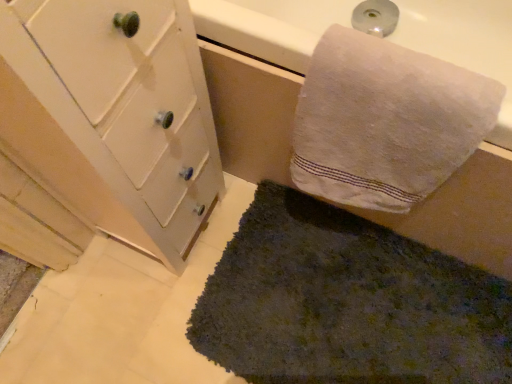
This screenshot has width=512, height=384. What do you see at coordinates (113, 115) in the screenshot?
I see `white painted wood cabinet at left` at bounding box center [113, 115].

The height and width of the screenshot is (384, 512). I want to click on dark green shaggy rug at lower center, so click(x=347, y=303).

Find the location of `white painted wood cabinet at left`. white painted wood cabinet at left is located at coordinates (113, 115).

In the image, there is a dark green shaggy rug at lower center. At what (x,y) coordinates should I click in order to perform the action: click on bathroom cabinet above it (from the image's perspective). Please return your answer as a coordinate pair (x, y). Looking at the image, I should click on click(x=113, y=115).

Is point (179, 58) more distant than point (343, 215)?

No, it is in front of (343, 215).

From the picture: Does white painted wood cabinet at left appear on the right side of dark green shaggy rug at lower center?

No.

Can you confirm if white painted wood cabinet at left is wider than dark green shaggy rug at lower center?

Incorrect, the width of white painted wood cabinet at left does not surpass that of dark green shaggy rug at lower center.

Does dark green shaggy rug at lower center appear on the right side of white cotton towel at upper right?

Yes, dark green shaggy rug at lower center is to the right of white cotton towel at upper right.

From a real-world perspective, is dark green shaggy rug at lower center positioned under white cotton towel at upper right based on gravity?

Yes, from a real-world perspective, dark green shaggy rug at lower center is beneath white cotton towel at upper right.

Is dark green shaggy rug at lower center turned away from white cotton towel at upper right?

No, white cotton towel at upper right is not at the back of dark green shaggy rug at lower center.

Can you confirm if white painted wood cabinet at left is positioned to the left of white cotton towel at upper right?

Yes, white painted wood cabinet at left is to the left of white cotton towel at upper right.

Choose the correct answer: Is white painted wood cabinet at left inside white cotton towel at upper right or outside it?

white painted wood cabinet at left cannot be found inside white cotton towel at upper right.

Is white painted wood cabinet at left facing away from white cotton towel at upper right?

No, white painted wood cabinet at left's orientation is not away from white cotton towel at upper right.

Image resolution: width=512 pixels, height=384 pixels. Identify the location of towel below the white painted wood cabinet at left (from the image's perspective). point(385,122).

Considering the sizes of objects white cotton towel at upper right and dark green shaggy rug at lower center in the image provided, who is thinner, white cotton towel at upper right or dark green shaggy rug at lower center?

Thinner between the two is white cotton towel at upper right.

Looking at this image, is white cotton towel at upper right looking in the opposite direction of dark green shaggy rug at lower center?

white cotton towel at upper right is not turned away from dark green shaggy rug at lower center.

Do you think white cotton towel at upper right is within dark green shaggy rug at lower center, or outside of it?

white cotton towel at upper right is spatially situated outside dark green shaggy rug at lower center.

Visually, is white cotton towel at upper right positioned to the left or to the right of dark green shaggy rug at lower center?

white cotton towel at upper right is to the left of dark green shaggy rug at lower center.

Between white cotton towel at upper right and white painted wood cabinet at left, which one appears on the right side from the viewer's perspective?

Positioned to the right is white cotton towel at upper right.

From a real-world perspective, is white cotton towel at upper right on top of white painted wood cabinet at left?

Indeed, from a real-world perspective, white cotton towel at upper right stands above white painted wood cabinet at left.

This screenshot has width=512, height=384. Find the location of `towel lying behind the white painted wood cabinet at left`. towel lying behind the white painted wood cabinet at left is located at coordinates (385, 122).

Is white cotton towel at upper right not close to white painted wood cabinet at left?

No, there isn't a large distance between white cotton towel at upper right and white painted wood cabinet at left.

Considering the positions of objects dark green shaggy rug at lower center and white painted wood cabinet at left in the image provided, who is in front, dark green shaggy rug at lower center or white painted wood cabinet at left?

white painted wood cabinet at left is in front.

In the image, is dark green shaggy rug at lower center on the left side or the right side of white painted wood cabinet at left?

Based on their positions, dark green shaggy rug at lower center is located to the right of white painted wood cabinet at left.

Is dark green shaggy rug at lower center facing towards white painted wood cabinet at left?

No, dark green shaggy rug at lower center does not turn towards white painted wood cabinet at left.

What's the angular difference between dark green shaggy rug at lower center and white painted wood cabinet at left's facing directions?

88.9 degrees.

Find the location of a particular element. The width and height of the screenshot is (512, 384). bathroom cabinet on the left of dark green shaggy rug at lower center is located at coordinates (113, 115).

Identify the location of bath mat lying behind the white cotton towel at upper right. (347, 303).

From the image, which object appears to be farther from white painted wood cabinet at left, dark green shaggy rug at lower center or white cotton towel at upper right?

dark green shaggy rug at lower center is further to white painted wood cabinet at left.

Based on their spatial positions, is white painted wood cabinet at left or dark green shaggy rug at lower center closer to white cotton towel at upper right?

white painted wood cabinet at left is closer to white cotton towel at upper right.

Estimate the real-world distances between objects in this image. Which object is closer to white painted wood cabinet at left, white cotton towel at upper right or dark green shaggy rug at lower center?

white cotton towel at upper right.

Estimate the real-world distances between objects in this image. Which object is further from dark green shaggy rug at lower center, white painted wood cabinet at left or white cotton towel at upper right?

white painted wood cabinet at left is positioned further to the anchor dark green shaggy rug at lower center.

From the image, which object appears to be farther from white cotton towel at upper right, dark green shaggy rug at lower center or white painted wood cabinet at left?

dark green shaggy rug at lower center is further to white cotton towel at upper right.

In the scene shown: When comparing their distances from dark green shaggy rug at lower center, does white cotton towel at upper right or white painted wood cabinet at left seem closer?

Based on the image, white cotton towel at upper right appears to be nearer to dark green shaggy rug at lower center.

Where is `towel between white painted wood cabinet at left and dark green shaggy rug at lower center`? The height and width of the screenshot is (384, 512). towel between white painted wood cabinet at left and dark green shaggy rug at lower center is located at coordinates (385, 122).